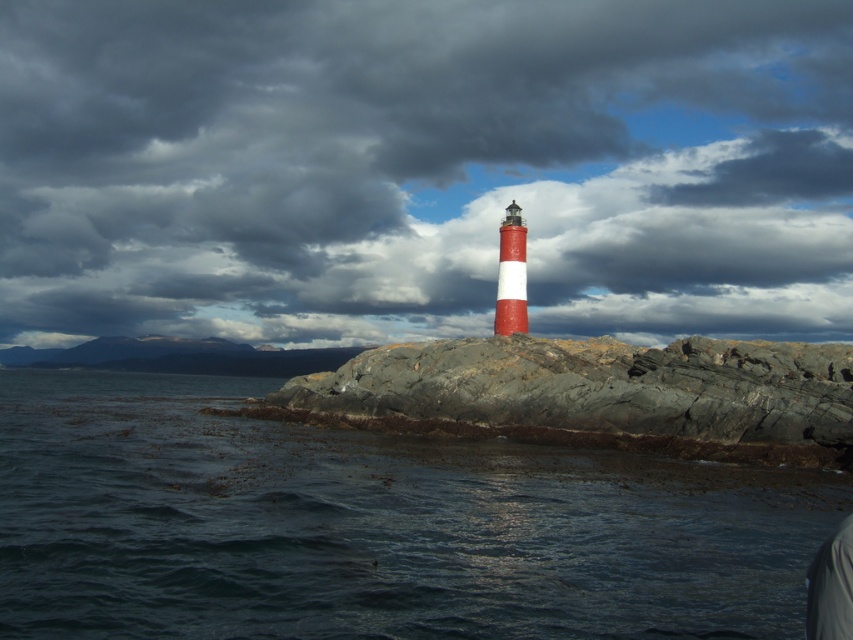
You are a hiker who has reached the base of the rocky outcrop where the lighthouse stands. You see the dark blue water at lower center and the rough granite rock at center. Which object is closer to your current position?

The dark blue water at lower center is closer to your current position because it is located below the rough granite rock at center, meaning the rock is elevated above the water.

You are a weather researcher analyzing the image. The lighthouse is located at coordinates point A. Where is the dark gray cloud at center in relation to the lighthouse?

The dark gray cloud at center is located at point A, which is at coordinates point A. The dark gray cloud at center is at point A, which is at coordinates point A. The dark gray cloud at center is at point A, which is at coordinates point A. The dark gray cloud at center is at point A, which is at coordinates point A. The dark gray cloud at center is at point A, which is at coordinates point A. The dark gray cloud at center is at point A, which is at coordinates point A. The dark gray cloud at center is at